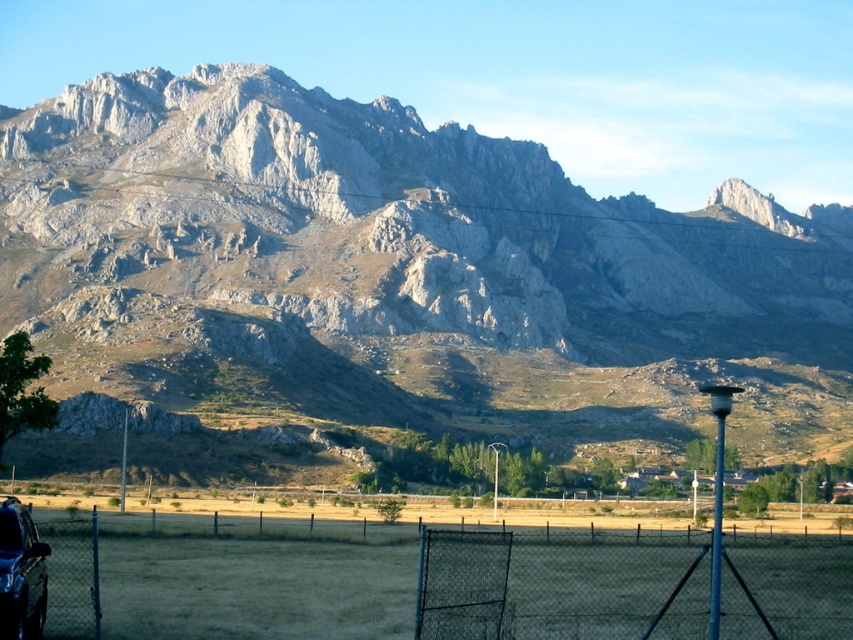
In the scene shown: Can you confirm if black chain-link fence at lower center is smaller than shiny black car at lower left?

Yes.

Does black chain-link fence at lower center come behind shiny black car at lower left?

Yes, it is behind shiny black car at lower left.

In order to click on black chain-link fence at lower center in this screenshot , I will do `click(560, 586)`.

At what (x,y) coordinates should I click in order to perform the action: click on black chain-link fence at lower center. Please return your answer as a coordinate pair (x, y). The height and width of the screenshot is (640, 853). Looking at the image, I should click on (560, 586).

In the scene shown: Who is positioned more to the right, gray rock mountain range at upper center or gray chain-link fence at lower center?

Positioned to the right is gray chain-link fence at lower center.

Is gray rock mountain range at upper center above gray chain-link fence at lower center?

Yes.

Which is behind, point (743, 280) or point (670, 572)?

Positioned behind is point (743, 280).

Find the location of `gray rock mountain range at upper center`. gray rock mountain range at upper center is located at coordinates (405, 272).

Does gray rock mountain range at upper center have a greater height compared to black chain-link fence at lower center?

Yes, gray rock mountain range at upper center is taller than black chain-link fence at lower center.

Does point (440, 419) come behind point (782, 580)?

Yes, point (440, 419) is farther from viewer.

Is point (238, 310) more distant than point (548, 538)?

Yes, point (238, 310) is behind point (548, 538).

Locate an element on the screen. This screenshot has width=853, height=640. gray rock mountain range at upper center is located at coordinates (405, 272).